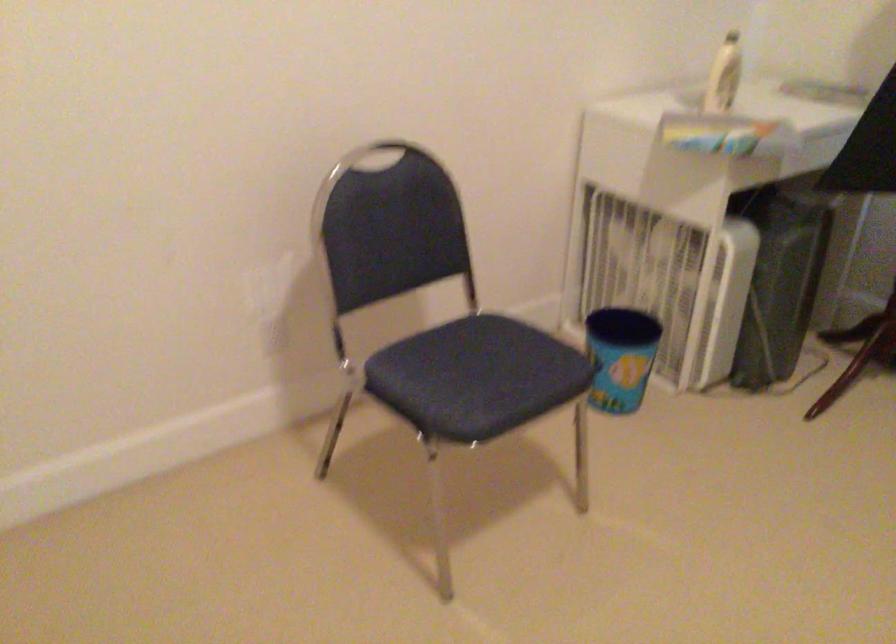
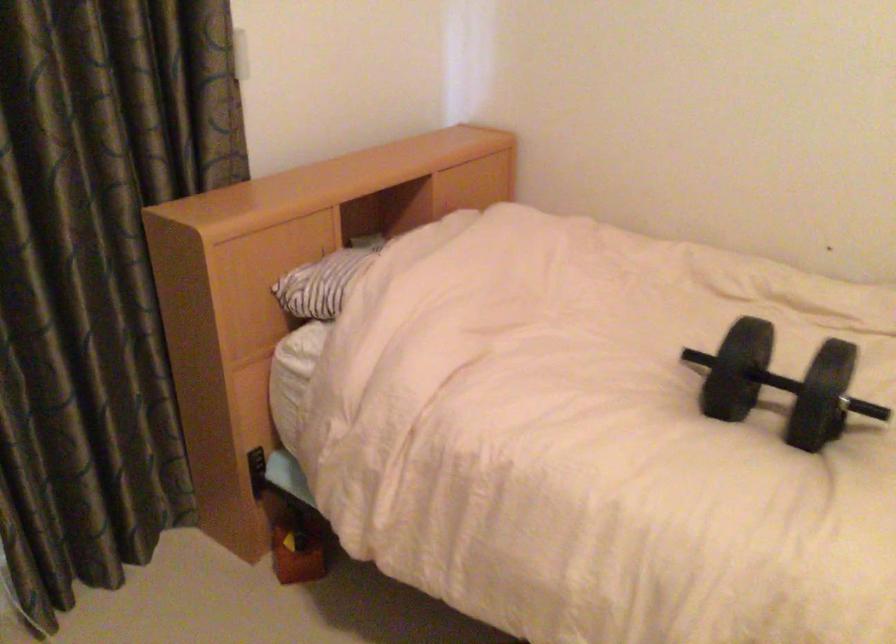
The images are taken continuously from a first-person perspective. In which direction is your viewpoint rotating?

The camera's rotation is toward right-down.